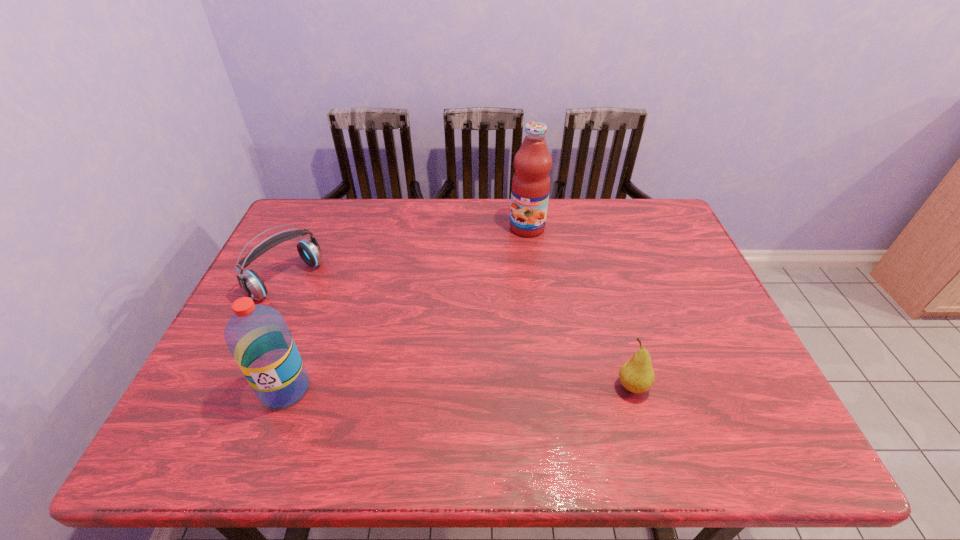
Find the location of `vacant space that's between the pear and the headset`. vacant space that's between the pear and the headset is located at coordinates (460, 333).

I want to click on empty space between the fruit juice and the headset, so click(407, 254).

Locate an element on the screen. The image size is (960, 540). the third closest object relative to the farthest object is located at coordinates (257, 336).

Choose which object is the second nearest neighbor to the third object from left to right. Please provide its 2D coordinates. Your answer should be formatted as a tuple, i.e. [(x, y)], where the tuple contains the x and y coordinates of a point satisfying the conditions above.

[(251, 284)]

Identify the location of free space that satisfies the following two spatial constraints: 1. on the front side of the pear; 2. on the right side of the second object from right to left. The height and width of the screenshot is (540, 960). (548, 387).

This screenshot has width=960, height=540. I want to click on vacant space that satisfies the following two spatial constraints: 1. on the front side of the rightmost object; 2. on the right side of the third nearest object, so click(x=238, y=387).